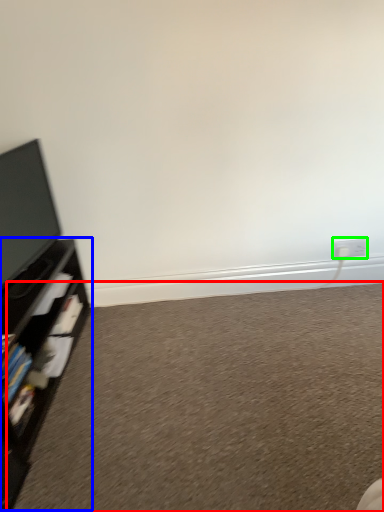
Question: Considering the real-world distances, which object is farthest from plain (highlighted by a red box)? shelf (highlighted by a blue box) or electric outlet (highlighted by a green box)?

Choices:
 (A) shelf
 (B) electric outlet

Answer: (B)